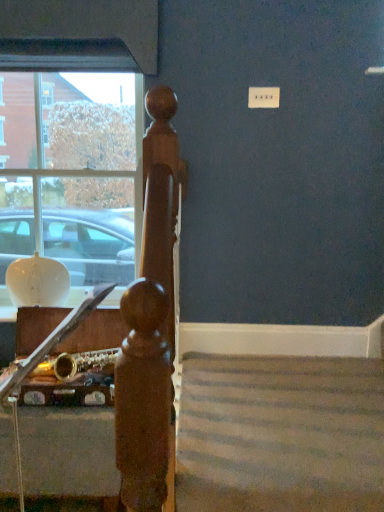
Question: Visually, is clear glass window at upper left positioned to the left or to the right of gold metallic saxophone at lower left?

Choices:
 (A) right
 (B) left

Answer: (B)

Question: Considering the positions of clear glass window at upper left and gold metallic saxophone at lower left in the image, is clear glass window at upper left bigger or smaller than gold metallic saxophone at lower left?

Choices:
 (A) small
 (B) big

Answer: (A)

Question: Does point (125, 102) appear closer or farther from the camera than point (89, 330)?

Choices:
 (A) farther
 (B) closer

Answer: (A)

Question: From the image's perspective, is gold metallic saxophone at lower left above or below clear glass window at upper left?

Choices:
 (A) above
 (B) below

Answer: (B)

Question: Relative to clear glass window at upper left, is gold metallic saxophone at lower left in front or behind?

Choices:
 (A) front
 (B) behind

Answer: (A)

Question: In terms of width, does gold metallic saxophone at lower left look wider or thinner when compared to clear glass window at upper left?

Choices:
 (A) wide
 (B) thin

Answer: (A)

Question: From a real-world perspective, is gold metallic saxophone at lower left positioned above or below clear glass window at upper left?

Choices:
 (A) above
 (B) below

Answer: (B)